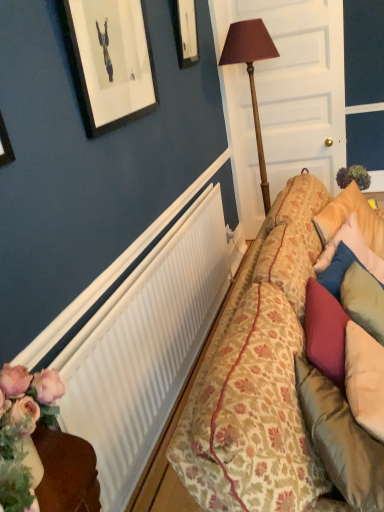
Image resolution: width=384 pixels, height=512 pixels. What do you see at coordinates (186, 32) in the screenshot? I see `wooden picture frame at upper center` at bounding box center [186, 32].

You are a GUI agent. You are given a task and a screenshot of the screen. Output one action in this format:
    pyautogui.click(x=<x>, y=<y>)
    Task: Click on the white ribbed radiator at center
    The height and width of the screenshot is (512, 384).
    Given the screenshot: What is the action you would take?
    pyautogui.click(x=145, y=347)

What is the approximate height of wooden table lamp at center?

It is 1.60 meters.

The image size is (384, 512). I want to click on wooden picture frame at upper center, so click(186, 32).

From a real-world perspective, is floral-patterned fabric couch at right on wooden picture frame at upper center?

Actually, floral-patterned fabric couch at right is physically below wooden picture frame at upper center in the real world.

From the image's perspective, is floral-patterned fabric couch at right positioned above or below wooden picture frame at upper center?

Based on their image positions, floral-patterned fabric couch at right is located beneath wooden picture frame at upper center.

Is floral-patterned fabric couch at right next to wooden picture frame at upper center and touching it?

No, floral-patterned fabric couch at right is not beside wooden picture frame at upper center.

Is the position of floral-patterned fabric couch at right more distant than that of wooden picture frame at upper center?

No, it is not.

Considering the relative positions of white wood door at center and floral-patterned fabric couch at right in the image provided, is white wood door at center to the left of floral-patterned fabric couch at right from the viewer's perspective?

No, white wood door at center is not to the left of floral-patterned fabric couch at right.

How much distance is there between white wood door at center and floral-patterned fabric couch at right?

They are 5.09 feet apart.

Is white wood door at center not inside floral-patterned fabric couch at right?

Absolutely, white wood door at center is external to floral-patterned fabric couch at right.

In terms of size, does white wood door at center appear bigger or smaller than floral-patterned fabric couch at right?

white wood door at center is smaller than floral-patterned fabric couch at right.

Which of these two, white ribbed radiator at center or wooden picture frame at upper center, stands taller?

white ribbed radiator at center.

Does point (125, 311) come closer to viewer compared to point (178, 30)?

Yes, it is in front of point (178, 30).

Consider the image. Is white ribbed radiator at center inside or outside of wooden picture frame at upper center?

white ribbed radiator at center is not inside wooden picture frame at upper center, it's outside.

Considering the relative positions of wooden picture frame at upper center and white wood door at center in the image provided, is wooden picture frame at upper center to the left or to the right of white wood door at center?

wooden picture frame at upper center is to the left of white wood door at center.

Does wooden picture frame at upper center have a greater width compared to white wood door at center?

In fact, wooden picture frame at upper center might be narrower than white wood door at center.

What are the coordinates of `door on the right side of wooden picture frame at upper center` in the screenshot? It's located at pyautogui.click(x=297, y=85).

Based on the photo, from the image's perspective, is wooden picture frame at upper center over white wood door at center?

Yes, from the image's perspective, wooden picture frame at upper center is over white wood door at center.

Between floral-patterned fabric couch at right and white ribbed radiator at center, which one has larger size?

Bigger between the two is floral-patterned fabric couch at right.

Can you tell me how much floral-patterned fabric couch at right and white ribbed radiator at center differ in facing direction?

The facing directions of floral-patterned fabric couch at right and white ribbed radiator at center are 0.36 degrees apart.

Which of these two, floral-patterned fabric couch at right or white ribbed radiator at center, stands shorter?

white ribbed radiator at center is shorter.

I want to click on radiator below the white wood door at center (from the image's perspective), so click(x=145, y=347).

Which object is further away from the camera, white wood door at center or white ribbed radiator at center?

white wood door at center.

Would you say white wood door at center is to the left or to the right of white ribbed radiator at center in the picture?

white wood door at center is positioned on white ribbed radiator at center's right side.

Is white wood door at center placed right next to white ribbed radiator at center?

No, white wood door at center is not next to white ribbed radiator at center.

Does point (186, 9) lie in front of point (214, 256)?

Yes, it is in front of point (214, 256).

Is wooden picture frame at upper center far from white ribbed radiator at center?

Absolutely, wooden picture frame at upper center is distant from white ribbed radiator at center.

Visually, is wooden picture frame at upper center positioned to the left or to the right of white ribbed radiator at center?

From the image, it's evident that wooden picture frame at upper center is to the right of white ribbed radiator at center.

Is wooden picture frame at upper center spatially inside white ribbed radiator at center, or outside of it?

wooden picture frame at upper center is not inside white ribbed radiator at center, it's outside.

The image size is (384, 512). What are the coordinates of `picture frame behind the floral-patterned fabric couch at right` in the screenshot? It's located at (186, 32).

The image size is (384, 512). I want to click on studio couch lying on the left of white wood door at center, so click(257, 376).

Considering their positions, is floral-patterned fabric couch at right positioned further to white wood door at center than wooden table lamp at center?

Based on the image, floral-patterned fabric couch at right appears to be further to white wood door at center.

From the image, which object appears to be farther from white wood door at center, wooden table lamp at center or white ribbed radiator at center?

white ribbed radiator at center is positioned further to the anchor white wood door at center.

From the image, which object appears to be farther from floral-patterned fabric couch at right, white ribbed radiator at center or wooden table lamp at center?

Based on the image, wooden table lamp at center appears to be further to floral-patterned fabric couch at right.

Which object lies nearer to the anchor point floral-patterned fabric couch at right, wooden table lamp at center or white ribbed radiator at center?

The object closer to floral-patterned fabric couch at right is white ribbed radiator at center.

In the scene shown: From the image, which object appears to be farther from white ribbed radiator at center, wooden picture frame at upper center or white wood door at center?

wooden picture frame at upper center is further to white ribbed radiator at center.

Which object lies nearer to the anchor point wooden picture frame at upper center, white ribbed radiator at center or white wood door at center?

white wood door at center.

Which object lies further to the anchor point wooden picture frame at upper center, white wood door at center or white ribbed radiator at center?

Based on the image, white ribbed radiator at center appears to be further to wooden picture frame at upper center.

Considering their positions, is wooden table lamp at center positioned further to white ribbed radiator at center than wooden picture frame at upper center?

wooden table lamp at center is positioned further to the anchor white ribbed radiator at center.

Identify the location of radiator between floral-patterned fabric couch at right and white wood door at center from front to back. This screenshot has height=512, width=384. (145, 347).

At what (x,y) coordinates should I click in order to perform the action: click on table lamp between wooden picture frame at upper center and white ribbed radiator at center in the up-down direction. Please return your answer as a coordinate pair (x, y). Looking at the image, I should click on (251, 75).

You are a GUI agent. You are given a task and a screenshot of the screen. Output one action in this format:
    pyautogui.click(x=<x>, y=<y>)
    Task: Click on the radiator between floral-patterned fabric couch at right and wooden table lamp at center from front to back
    Image resolution: width=384 pixels, height=512 pixels.
    Given the screenshot: What is the action you would take?
    pyautogui.click(x=145, y=347)

Locate an element on the screen. table lamp situated between wooden picture frame at upper center and white wood door at center from left to right is located at coordinates (251, 75).